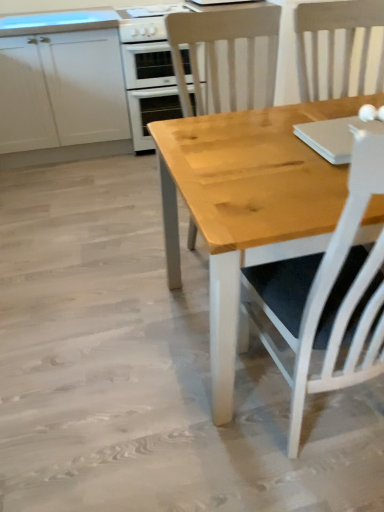
Where is `free point to the left of wooden chair at center`? This screenshot has width=384, height=512. free point to the left of wooden chair at center is located at coordinates (132, 270).